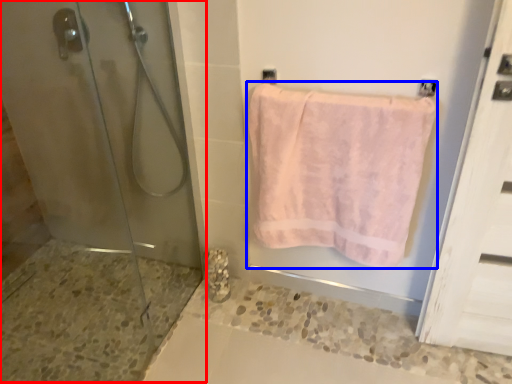
Question: Which point is closer to the camera, shower door (highlighted by a red box) or towel (highlighted by a blue box)?

Choices:
 (A) shower door
 (B) towel

Answer: (A)